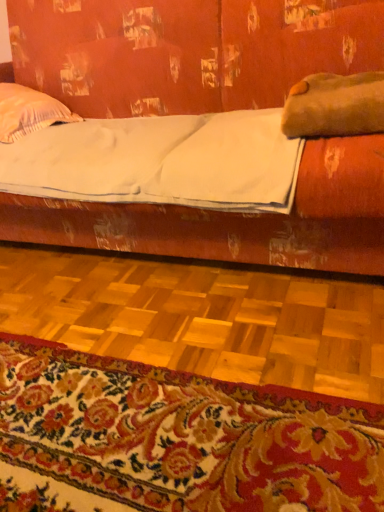
Question: Considering the relative positions of floral carpet at lower center and white matte sheet at center in the image provided, is floral carpet at lower center to the left or to the right of white matte sheet at center?

Choices:
 (A) right
 (B) left

Answer: (A)

Question: Considering their positions, is floral carpet at lower center located in front of or behind white matte sheet at center?

Choices:
 (A) behind
 (B) front

Answer: (B)

Question: Which of these objects is positioned closest to the matte wood studio couch at upper center?

Choices:
 (A) white matte sheet at center
 (B) white striped pillow at upper left, which ranks as the 2th pillow in right-to-left order
 (C) brown fuzzy pillow at upper right, positioned as the first pillow in right-to-left order
 (D) floral carpet at lower center

Answer: (B)

Question: Which is nearer to the matte wood studio couch at upper center?

Choices:
 (A) white matte sheet at center
 (B) white striped pillow at upper left, which is the second pillow in front-to-back order
 (C) floral carpet at lower center
 (D) brown fuzzy pillow at upper right, acting as the 2th pillow starting from the left

Answer: (B)